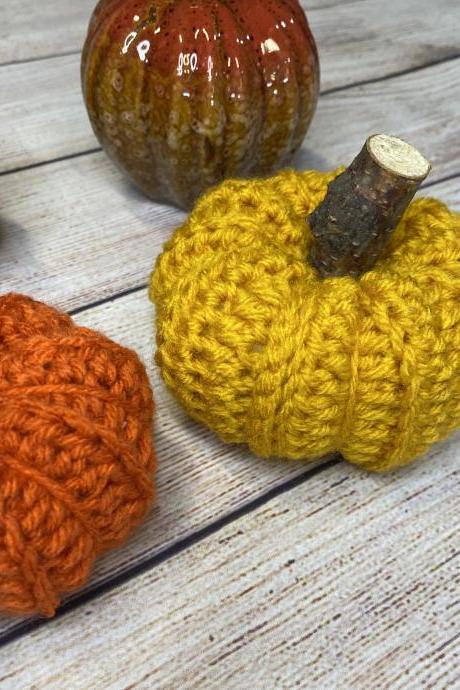
The width and height of the screenshot is (460, 690). Identify the location of surface. (181, 508).